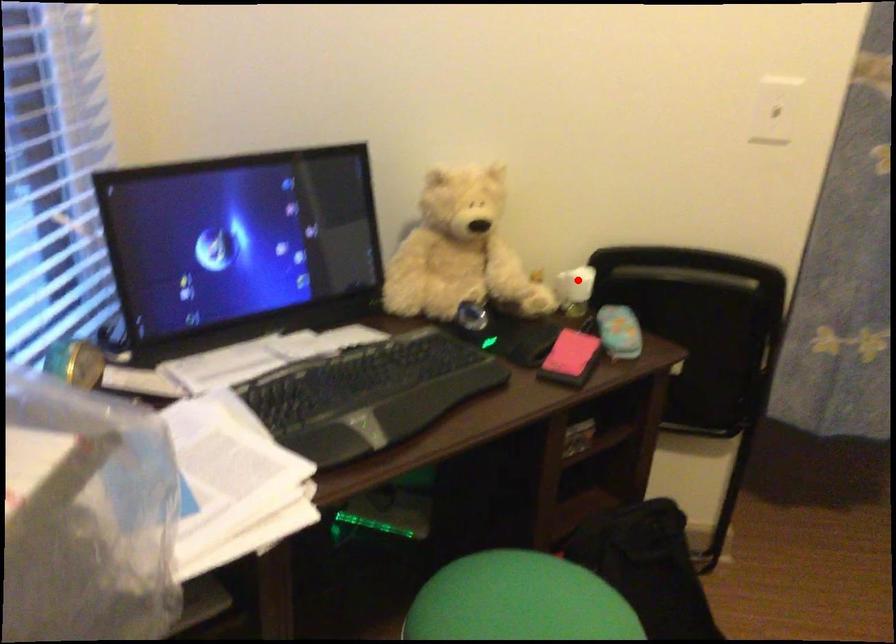
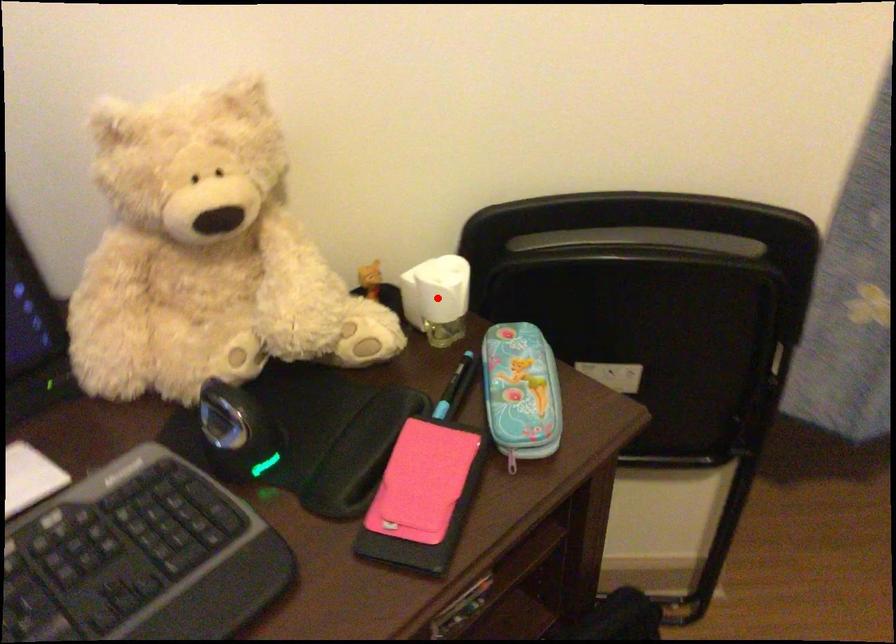
I am providing you with two images of the same scene from different viewpoints. A red point is marked on the first image and another point is marked on the second image. Do the highlighted points in image1 and image2 indicate the same real-world spot?

Yes